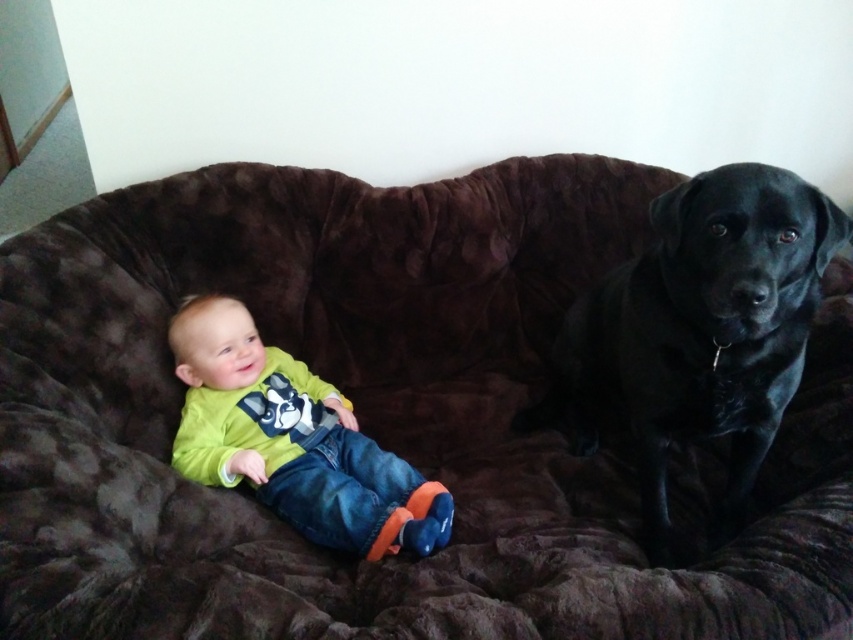
Is black velvet dog at right closer to the viewer compared to lime green jersey at center?

Yes, black velvet dog at right is in front of lime green jersey at center.

Locate an element on the screen. This screenshot has width=853, height=640. black velvet dog at right is located at coordinates (698, 330).

Image resolution: width=853 pixels, height=640 pixels. I want to click on black velvet dog at right, so click(698, 330).